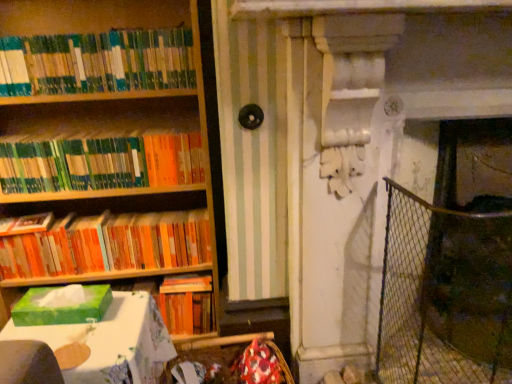
Identify the location of free point below green matte bookshelf at upper left, acting as the 2th book starting from the bottom (from a real-world perspective). (100, 210).